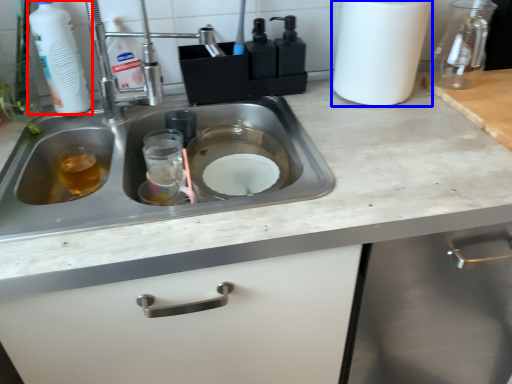
Question: Which object appears farthest to the camera in this image, cleaning product (highlighted by a red box) or paper towel (highlighted by a blue box)?

Choices:
 (A) cleaning product
 (B) paper towel

Answer: (B)